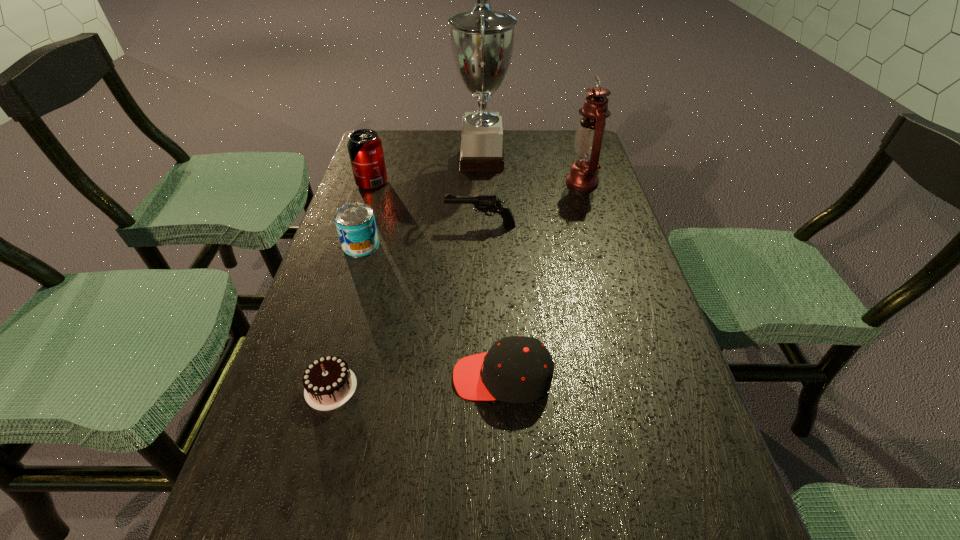
The image size is (960, 540). Find the location of `trophy cup`. trophy cup is located at coordinates 482,40.

At what (x,y) coordinates should I click in order to perform the action: click on oil lamp. Please return your answer as a coordinate pair (x, y). This screenshot has width=960, height=540. Looking at the image, I should click on (590, 136).

This screenshot has height=540, width=960. I want to click on the sixth shortest object, so click(x=590, y=136).

Find the location of a particular element. The width and height of the screenshot is (960, 540). the fifth shortest object is located at coordinates (365, 149).

This screenshot has height=540, width=960. What are the coordinates of `gun` in the screenshot? It's located at (483, 203).

Locate an element on the screen. can is located at coordinates (355, 222).

The width and height of the screenshot is (960, 540). I want to click on cap, so [517, 369].

At what (x,y) coordinates should I click in order to perform the action: click on chocolate cake. Please return your answer as a coordinate pair (x, y). Looking at the image, I should click on (329, 383).

The height and width of the screenshot is (540, 960). Find the location of `blank area located 0.300m at the front view of the tallest object`. blank area located 0.300m at the front view of the tallest object is located at coordinates (360, 160).

Find the location of a particular element. The image size is (960, 540). vacant space located at the front view of the tallest object is located at coordinates (429, 160).